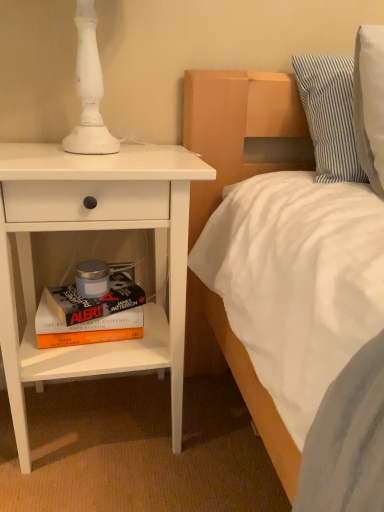
Locate an element on the screen. The height and width of the screenshot is (512, 384). vacant space to the right of white matte nightstand at left is located at coordinates (218, 434).